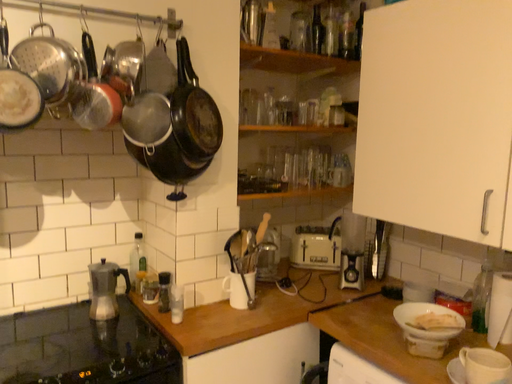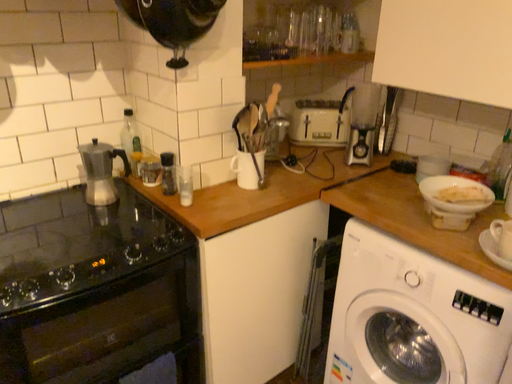
Question: Which way did the camera rotate in the video?

Choices:
 (A) rotated upward
 (B) rotated downward

Answer: (B)